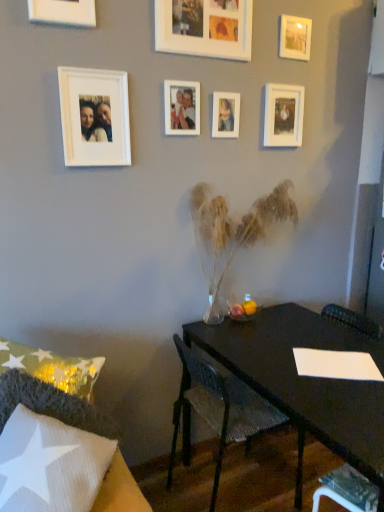
Question: Considering the relative sizes of white fabric chair at lower left, the first chair when ordered from front to back, and white paper at lower right in the image provided, is white fabric chair at lower left, the first chair when ordered from front to back, wider than white paper at lower right?

Choices:
 (A) yes
 (B) no

Answer: (A)

Question: Is white fabric chair at lower left, which appears as the first chair when viewed from the left, looking in the opposite direction of white paper at lower right?

Choices:
 (A) yes
 (B) no

Answer: (B)

Question: From a real-world perspective, is white fabric chair at lower left, the first chair when ordered from front to back, on top of white paper at lower right?

Choices:
 (A) no
 (B) yes

Answer: (B)

Question: Is white fabric chair at lower left, which appears as the first chair when viewed from the left, completely or partially outside of white paper at lower right?

Choices:
 (A) yes
 (B) no

Answer: (A)

Question: Considering the relative sizes of white fabric chair at lower left, which appears as the first chair when viewed from the left, and white paper at lower right in the image provided, is white fabric chair at lower left, which appears as the first chair when viewed from the left, shorter than white paper at lower right?

Choices:
 (A) yes
 (B) no

Answer: (A)

Question: Considering the positions of white paper at lower right and metallic silver swivel chair at lower right in the image, is white paper at lower right taller or shorter than metallic silver swivel chair at lower right?

Choices:
 (A) short
 (B) tall

Answer: (B)

Question: Looking at their shapes, would you say white paper at lower right is wider or thinner than metallic silver swivel chair at lower right?

Choices:
 (A) wide
 (B) thin

Answer: (A)

Question: Considering the relative positions of white paper at lower right and metallic silver swivel chair at lower right in the image provided, is white paper at lower right to the left or to the right of metallic silver swivel chair at lower right?

Choices:
 (A) right
 (B) left

Answer: (A)

Question: Does point (296, 367) appear closer or farther from the camera than point (347, 479)?

Choices:
 (A) farther
 (B) closer

Answer: (A)

Question: Is metallic silver swivel chair at lower right bigger or smaller than white matte picture frame at upper center, placed as the 4th picture frame when sorted from left to right?

Choices:
 (A) small
 (B) big

Answer: (B)

Question: In terms of width, does metallic silver swivel chair at lower right look wider or thinner when compared to white matte picture frame at upper center, placed as the 4th picture frame when sorted from left to right?

Choices:
 (A) thin
 (B) wide

Answer: (B)

Question: From a real-world perspective, is metallic silver swivel chair at lower right positioned above or below white matte picture frame at upper center, acting as the fourth picture frame starting from the right?

Choices:
 (A) below
 (B) above

Answer: (A)

Question: From the image's perspective, relative to white matte picture frame at upper center, placed as the 4th picture frame when sorted from left to right, is metallic silver swivel chair at lower right above or below?

Choices:
 (A) above
 (B) below

Answer: (B)

Question: Is matte white photo frame at center, the third picture frame positioned from the right, taller or shorter than white matte picture frame at upper left, the 2th picture frame from the left?

Choices:
 (A) tall
 (B) short

Answer: (B)

Question: Would you say matte white photo frame at center, the 5th picture frame when ordered from left to right, is to the left or to the right of white matte picture frame at upper left, the 2th picture frame from the left, in the picture?

Choices:
 (A) left
 (B) right

Answer: (B)